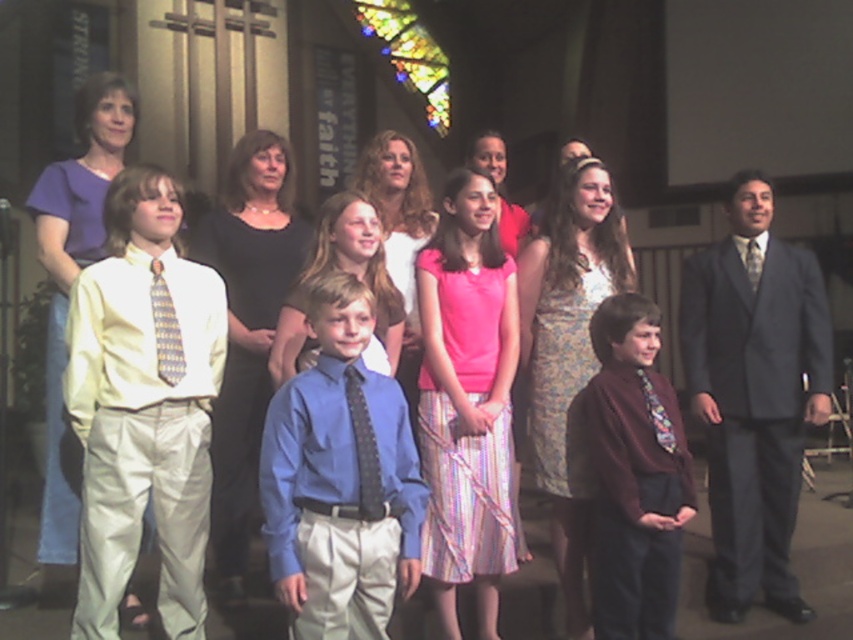
In the scene shown: You are a photographer trying to capture a photo of the group. You notice the matte yellow shirt at left and the blue satin shirt at center. Which shirt should you focus on to ensure it appears higher in the photo?

The matte yellow shirt at left should be focused on to ensure it appears higher in the photo because it is positioned above the blue satin shirt at center.

You are a photographer setting up for a group photo. You need to ensure that the gray suit at right and the blue satin shirt at center are both visible in the frame. Which clothing item requires more horizontal space to fully capture in the photo?

The gray suit at right requires more horizontal space because its width surpasses that of the blue satin shirt at center.

You are a photographer trying to capture a group photo of the matte yellow shirt at left and the gray suit at right. Since you want to ensure both subjects are in focus, you need to know their heights. Which one is shorter?

The matte yellow shirt at left is not as tall as the gray suit at right, so the matte yellow shirt at left is shorter.